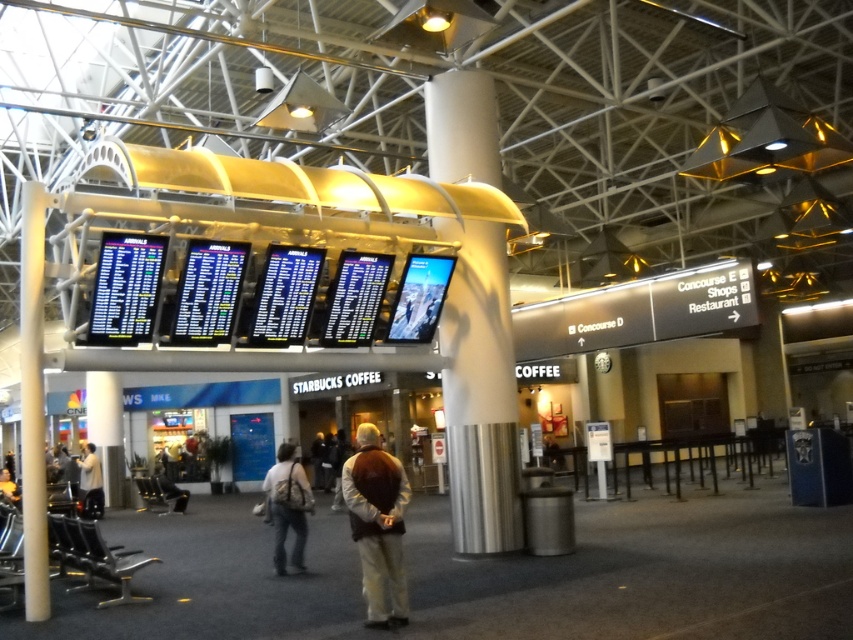
You are a traveler looking for your flight information screen. You see the white glossy pillar at center and the denim jacket at center. Which object is closer to the flight information screens?

The white glossy pillar at center is positioned over denim jacket at center, so the white glossy pillar at center is closer to the flight information screens.

In the scene shown: You are a traveler standing at the entrance of the airport terminal. You see a white glossy pillar at center and a light beige shirt at lower left. Which object is closer to you?

The light beige shirt at lower left is closer to you because the white glossy pillar at center is positioned over it, indicating it is further away.